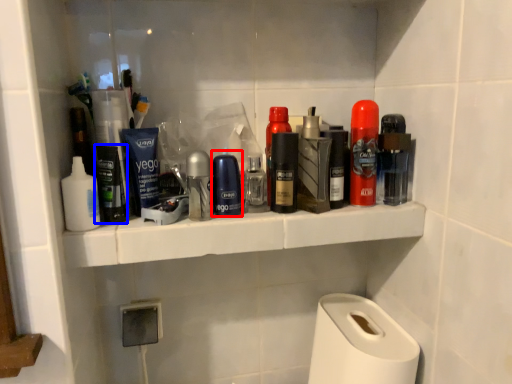
Question: Which of the following is the farthest to the observer, personal care (highlighted by a red box) or personal care (highlighted by a blue box)?

Choices:
 (A) personal care
 (B) personal care

Answer: (A)